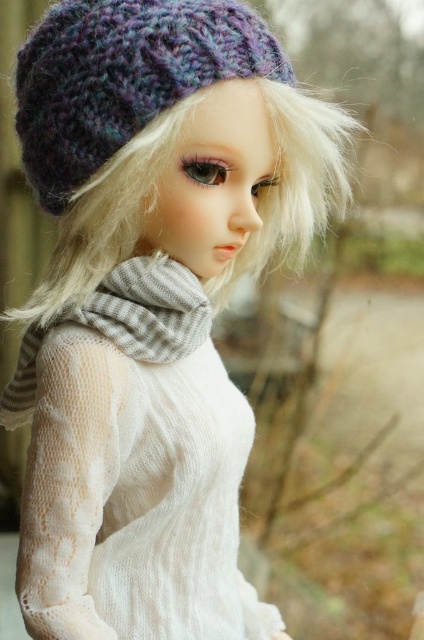
Question: Is purple knitted hat at upper center below gray striped scarf at center?

Choices:
 (A) no
 (B) yes

Answer: (A)

Question: Based on their relative distances, which object is farther from the white knitted dress at center?

Choices:
 (A) purple knitted hat at upper center
 (B) gray striped scarf at center

Answer: (A)

Question: Is white knitted dress at center to the left of purple knitted hat at upper center from the viewer's perspective?

Choices:
 (A) no
 (B) yes

Answer: (B)

Question: Is white knitted dress at center positioned behind purple knitted hat at upper center?

Choices:
 (A) yes
 (B) no

Answer: (B)

Question: Which of these objects is positioned farthest from the gray striped scarf at center?

Choices:
 (A) white knitted dress at center
 (B) purple knitted hat at upper center

Answer: (B)

Question: Which object is the closest to the white knitted dress at center?

Choices:
 (A) purple knitted hat at upper center
 (B) gray striped scarf at center

Answer: (B)